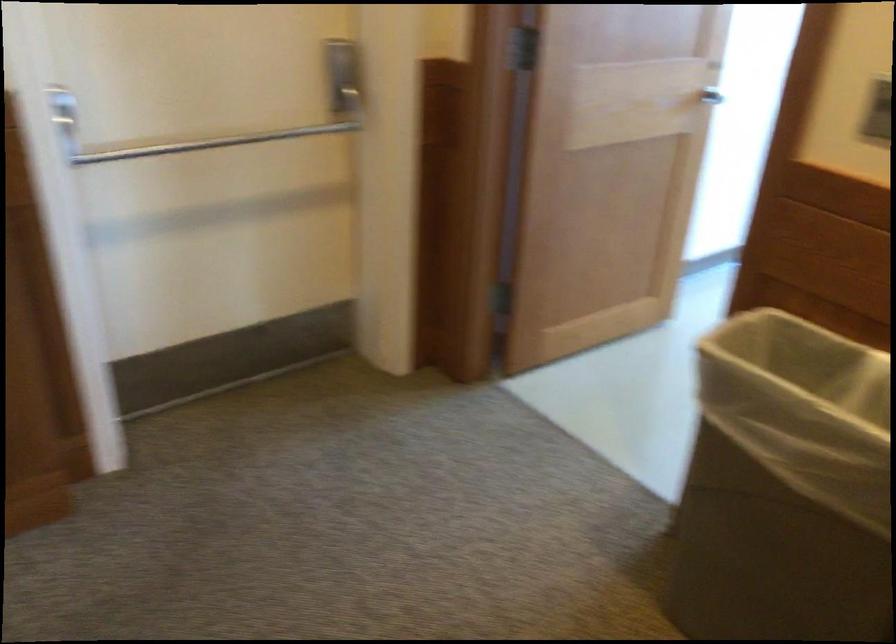
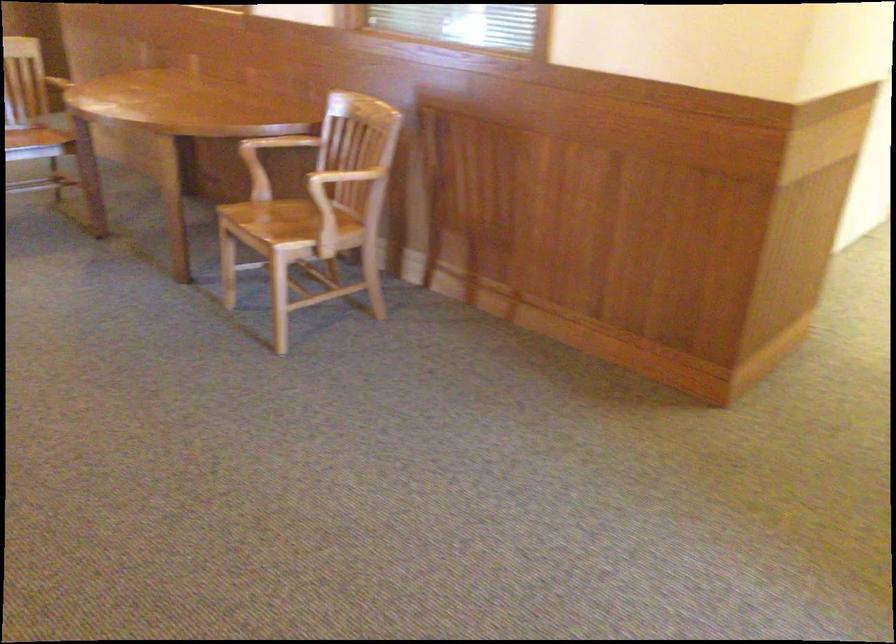
The first image is from the beginning of the video and the second image is from the end. How did the camera likely rotate when shooting the video?

The camera rotated toward left-down.